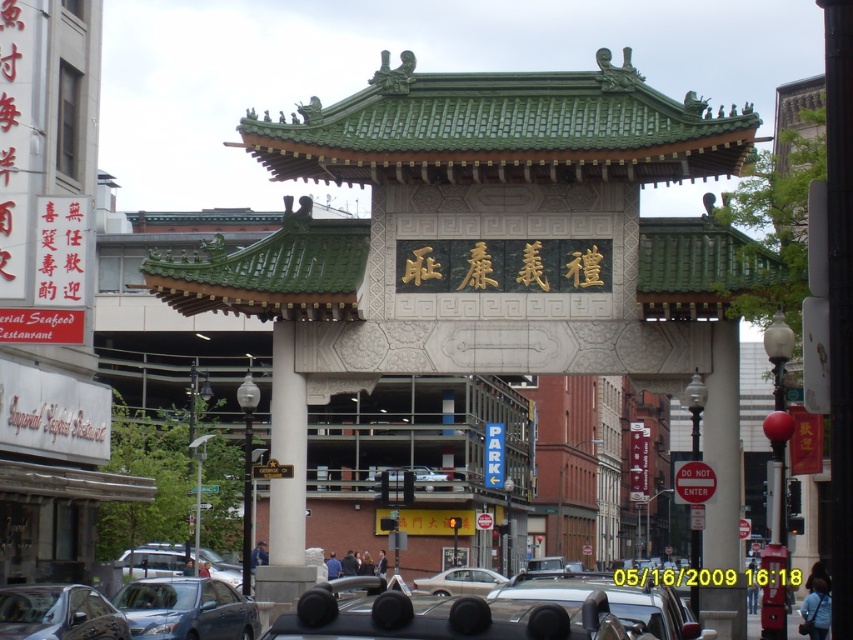
Question: Which object is closer to the camera taking this photo?

Choices:
 (A) matte black car at lower left
 (B) black metal sign at center
 (C) white matte car at center
 (D) white stone column at center

Answer: (B)

Question: Does matte black car at center have a greater width compared to silver metallic car at lower left?

Choices:
 (A) yes
 (B) no

Answer: (A)

Question: Which of these objects is positioned closest to the matte black car at center?

Choices:
 (A) black metal sign at center
 (B) matte black car at lower left

Answer: (B)

Question: Is matte black car at lower left below silver metallic car at lower left?

Choices:
 (A) yes
 (B) no

Answer: (B)

Question: Which object is positioned closest to the white matte car at center?

Choices:
 (A) matte black car at lower left
 (B) red plastic sign at center

Answer: (B)

Question: Does metallic silver sedan at center appear over black metal sign at center?

Choices:
 (A) no
 (B) yes

Answer: (B)